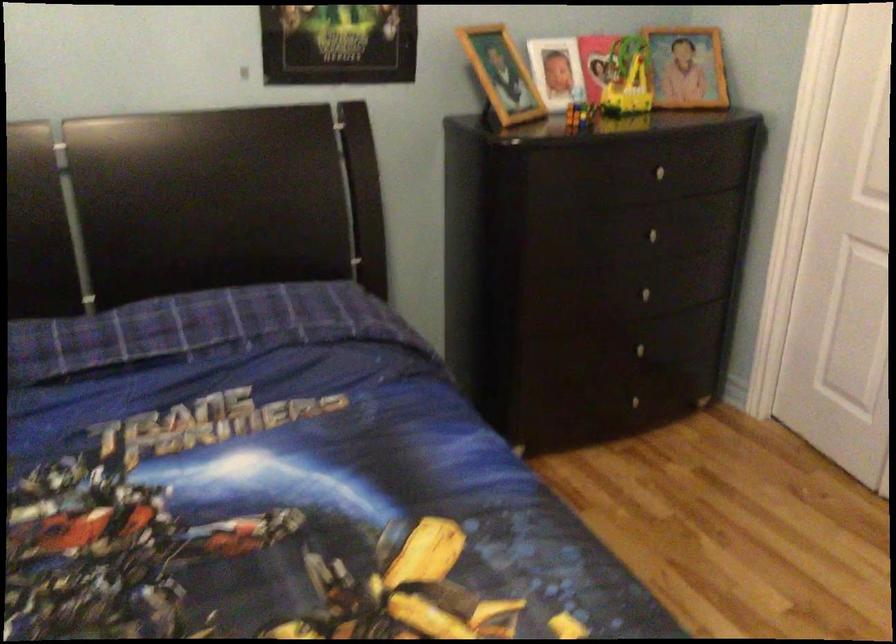
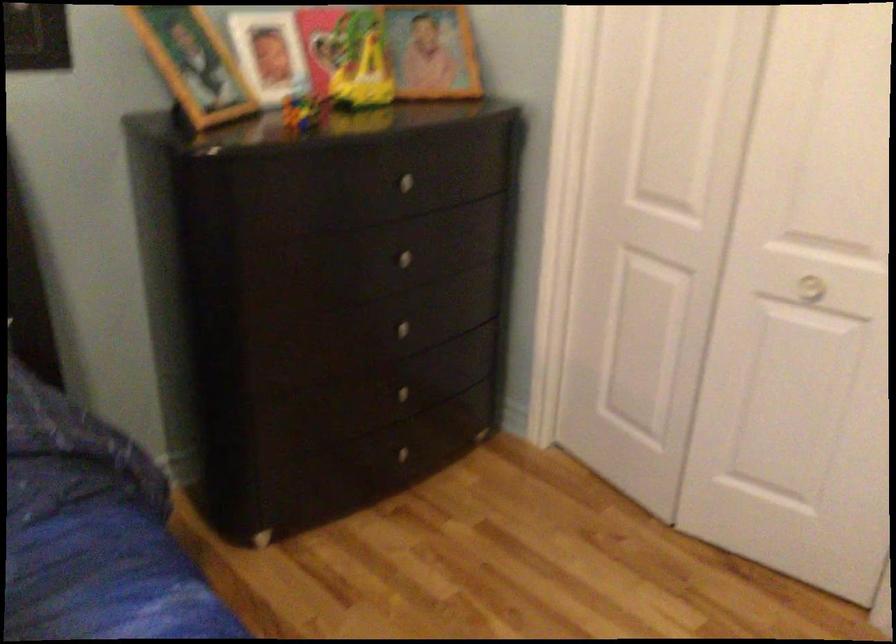
Locate, in the second image, the point that corresponds to point 650,297 in the first image.

(409, 332)